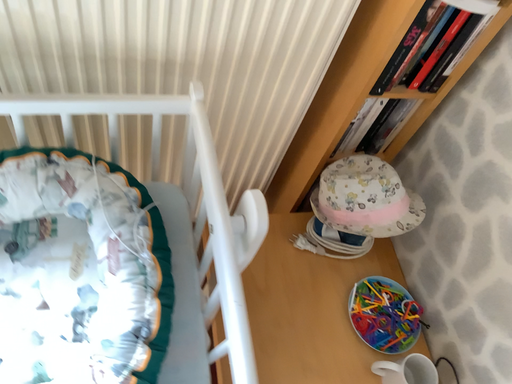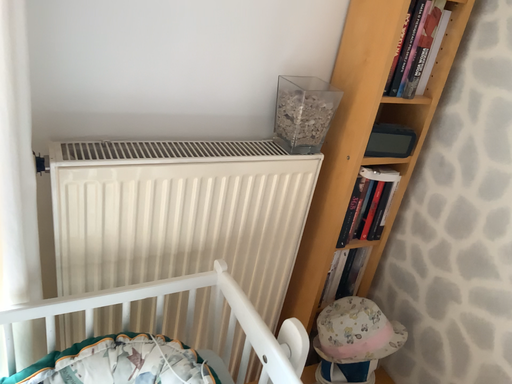
Question: How did the camera likely rotate when shooting the video?

Choices:
 (A) rotated downward
 (B) rotated upward

Answer: (B)